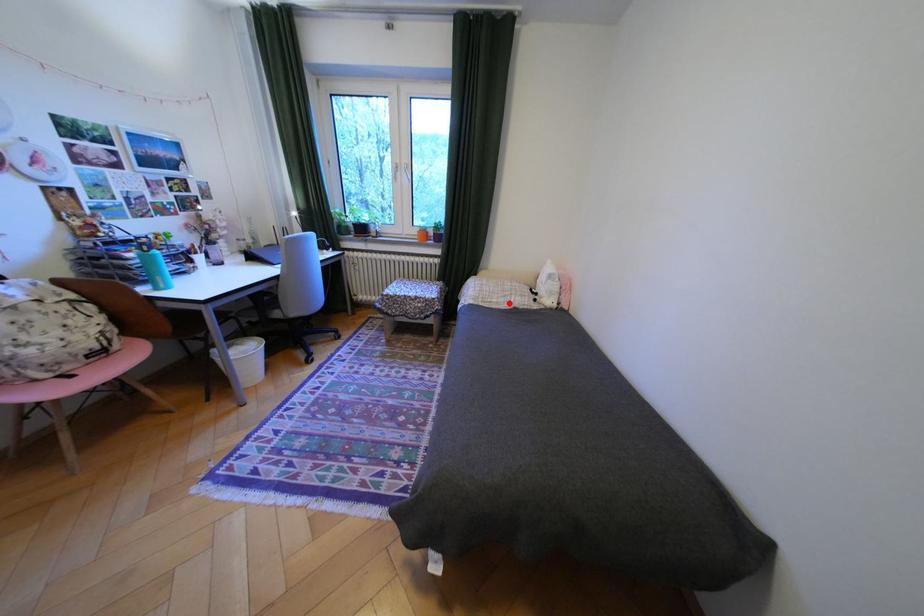
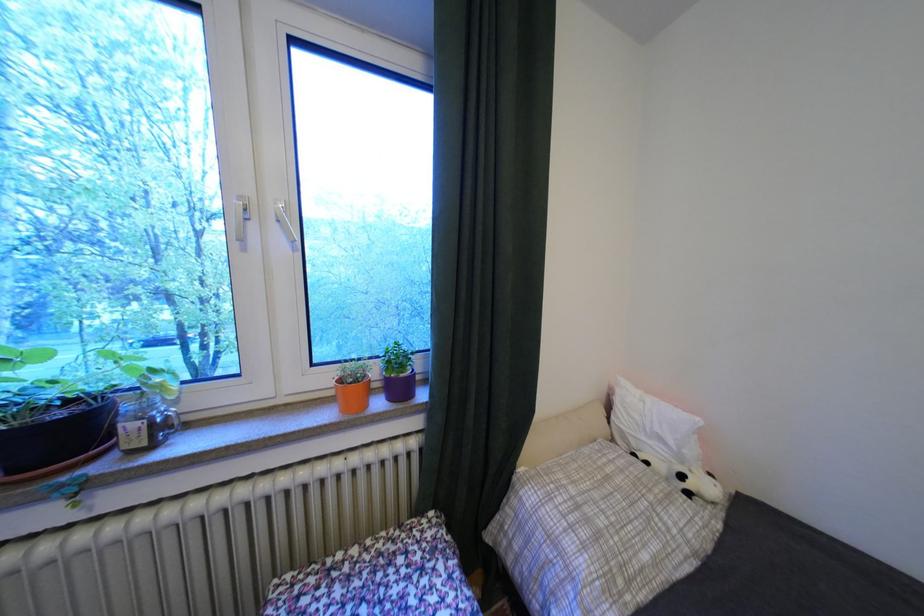
The point at the highlighted location is marked in the first image. Where is the corresponding point in the second image?

(667, 562)